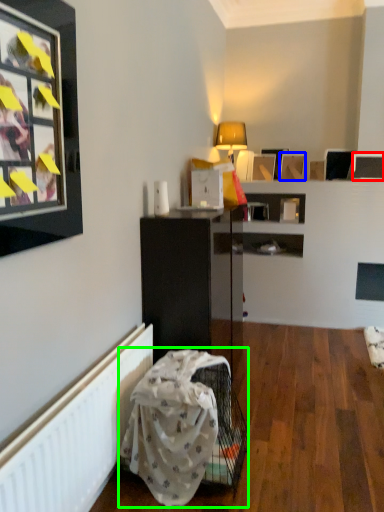
Question: Based on their relative distances, which object is nearer to picture frame (highlighted by a red box)? Choose from picture frame (highlighted by a blue box) and swivel chair (highlighted by a green box).

Choices:
 (A) picture frame
 (B) swivel chair

Answer: (A)